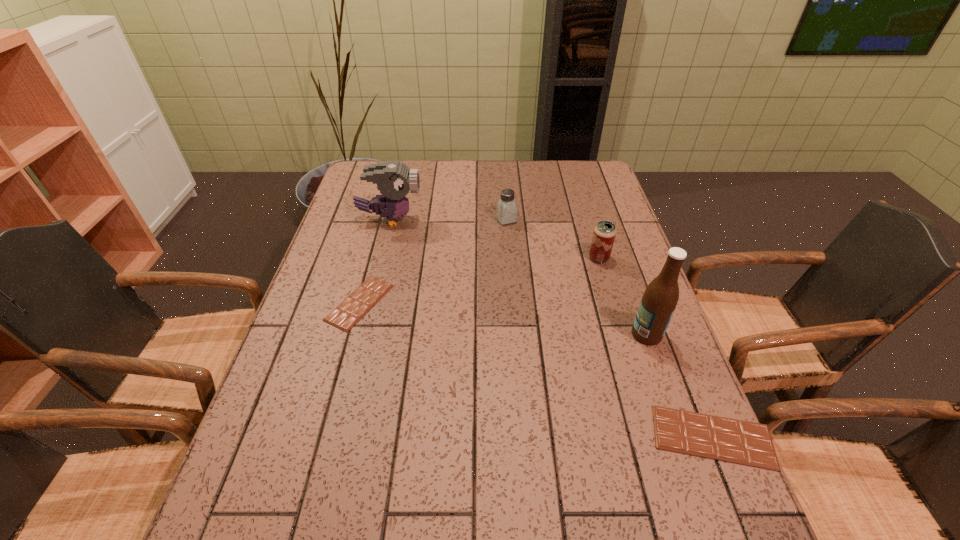
You are a GUI agent. You are given a task and a screenshot of the screen. Output one action in this format:
    pyautogui.click(x=<x>, y=<y>)
    Task: Click on the object that is at the near right corner
    
    Given the screenshot: What is the action you would take?
    pyautogui.click(x=730, y=440)

In the image, there is a desktop. Where is `vacant space at the far edge`? vacant space at the far edge is located at coordinates pyautogui.click(x=479, y=162).

The image size is (960, 540). Identify the location of vacant space at the left edge of the desktop. (300, 319).

Find the location of a particular element. free space at the right edge of the desktop is located at coordinates click(x=614, y=269).

The height and width of the screenshot is (540, 960). Find the location of `free space at the far right corner of the desktop`. free space at the far right corner of the desktop is located at coordinates (588, 180).

I want to click on free space between the taller chocolate bar and the farther chocolate bar, so click(x=536, y=370).

Locate an element on the screen. This screenshot has width=960, height=540. free space between the beer bottle and the shortest object is located at coordinates (503, 319).

Where is `unoccupied position between the saltshaker and the right chocolate bar`? The image size is (960, 540). unoccupied position between the saltshaker and the right chocolate bar is located at coordinates (610, 328).

The image size is (960, 540). Identify the location of free spot between the left chocolate bar and the right chocolate bar. (536, 370).

The height and width of the screenshot is (540, 960). In order to click on free space between the beer can and the bird in this screenshot , I will do `click(494, 239)`.